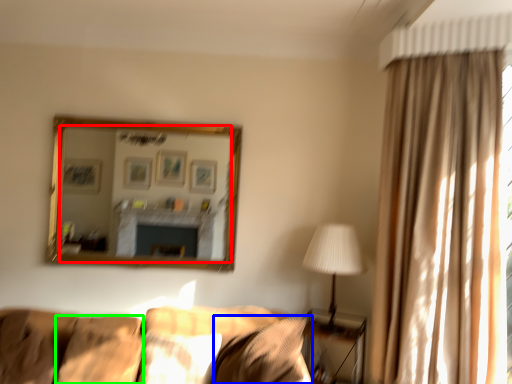
Question: Based on their relative distances, which object is farther from mirror (highlighted by a red box)? Choose from pillow (highlighted by a blue box) and pillow (highlighted by a green box).

Choices:
 (A) pillow
 (B) pillow

Answer: (A)